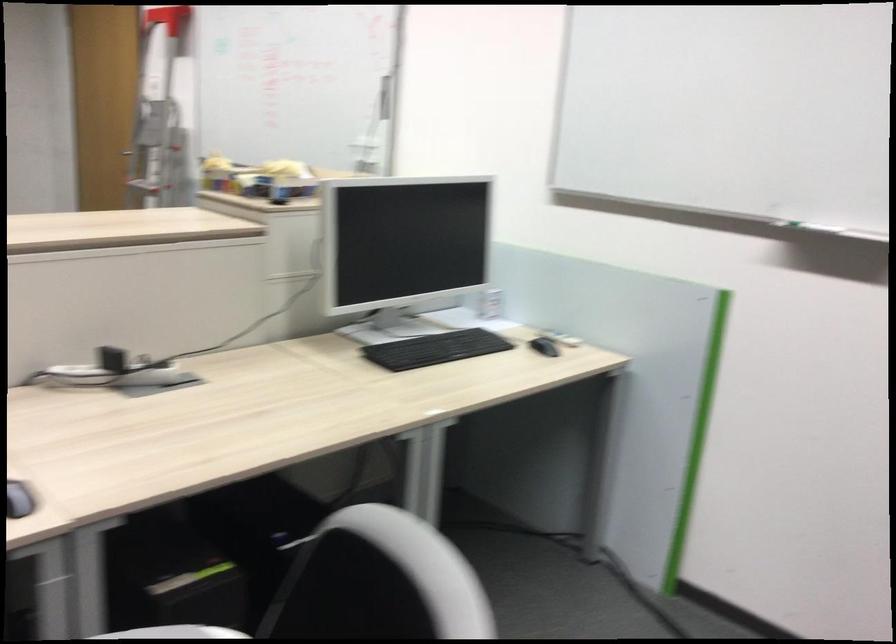
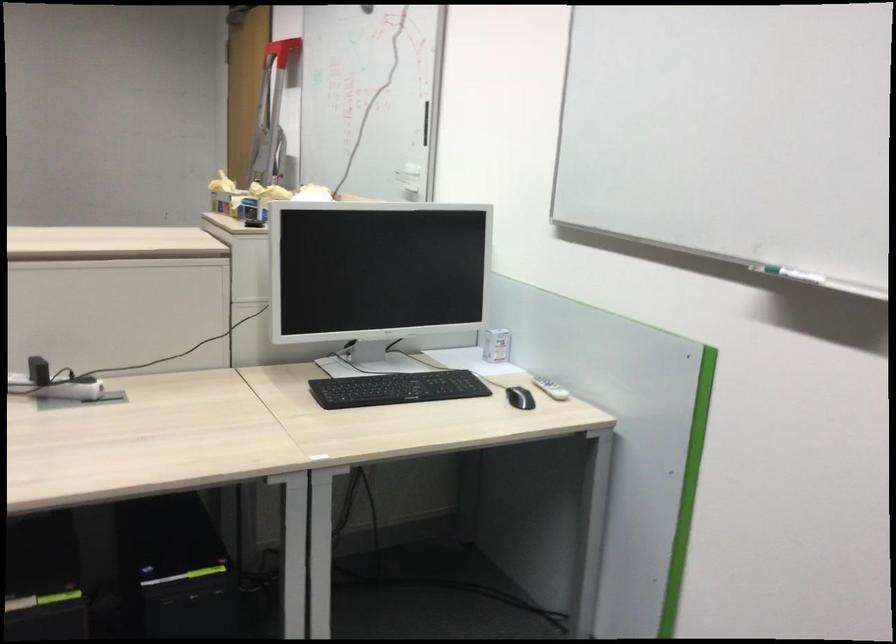
Question: Based on the continuous images, in which direction is the camera rotating? Reply with the corresponding letter.

Choices:
 (A) Left
 (B) Right
 (C) Up
 (D) Down

Answer: (A)